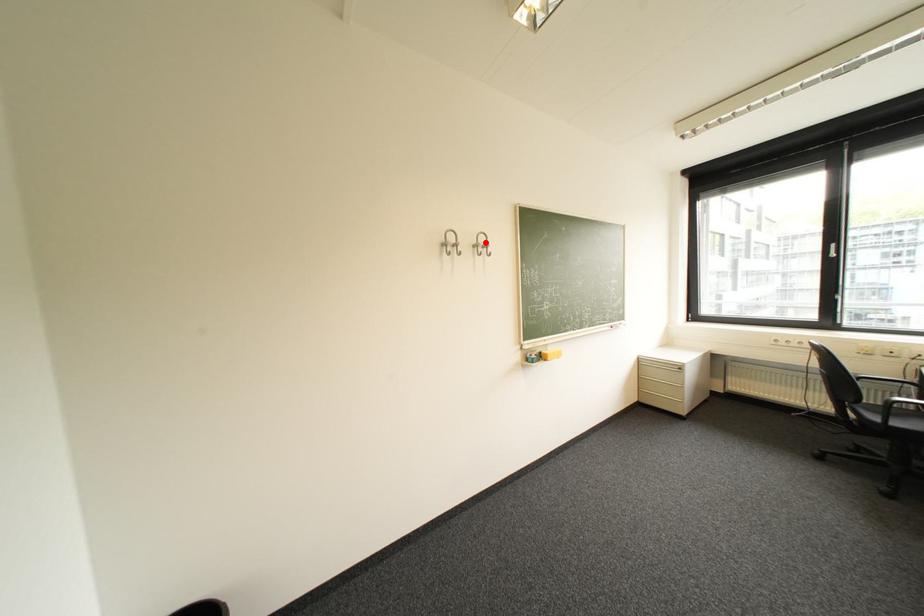
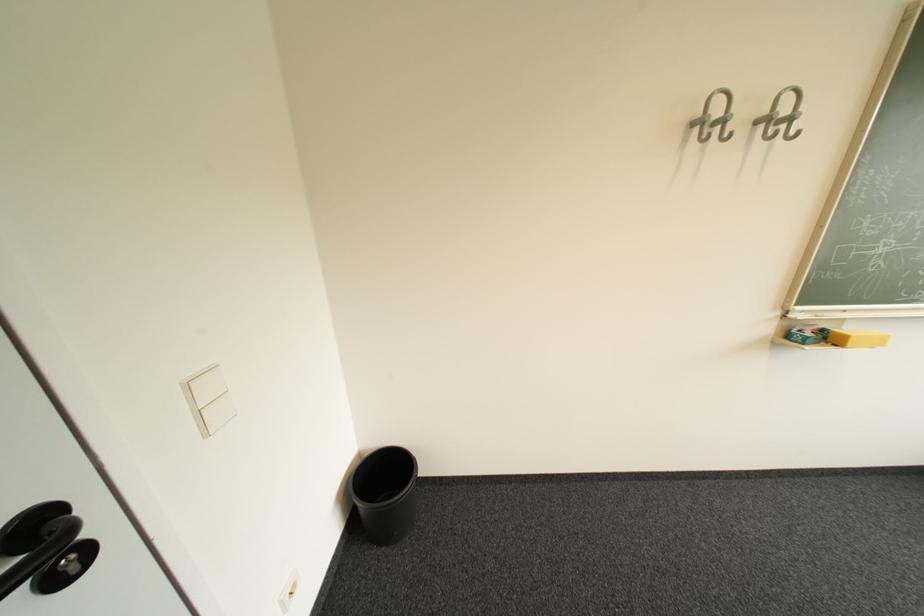
The point at the highlighted location is marked in the first image. Where is the corresponding point in the second image?

(775, 113)